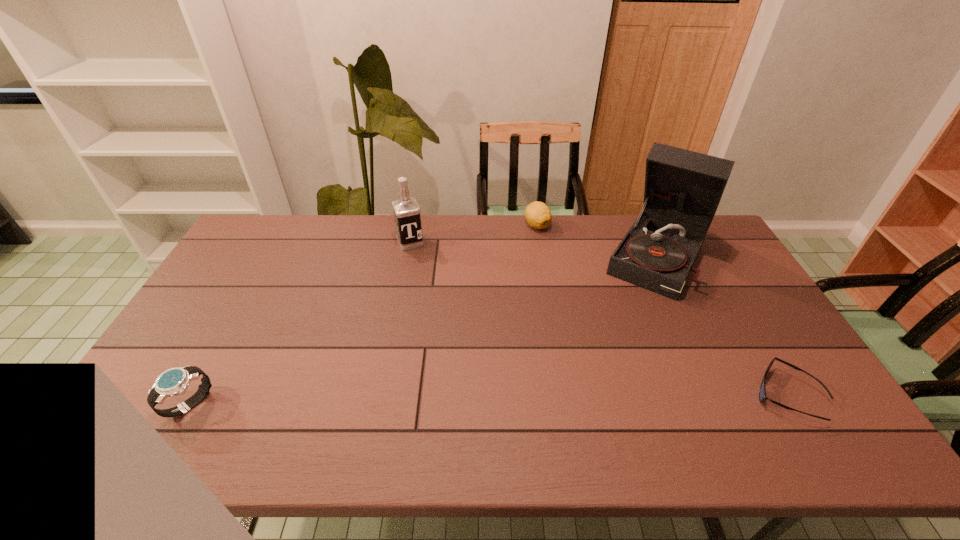
You are a GUI agent. You are given a task and a screenshot of the screen. Output one action in this format:
    pyautogui.click(x=<x>, y=<y>)
    Task: Click on the free space on the desktop that is between the watch and the shortest object and is positioned at the stem end of the lemon
    Image resolution: width=960 pixels, height=540 pixels.
    Given the screenshot: What is the action you would take?
    pyautogui.click(x=557, y=399)

Where is `vacant space on the desktop that is between the watch and the sunglasses and is positioned on the front label of the fourth shortest object`? The image size is (960, 540). vacant space on the desktop that is between the watch and the sunglasses and is positioned on the front label of the fourth shortest object is located at coordinates 480,400.

The height and width of the screenshot is (540, 960). In order to click on free spot on the desktop that is between the leftmost object and the sunglasses and is positioned on the front-facing side of the phonograph_record in this screenshot , I will do `click(577, 399)`.